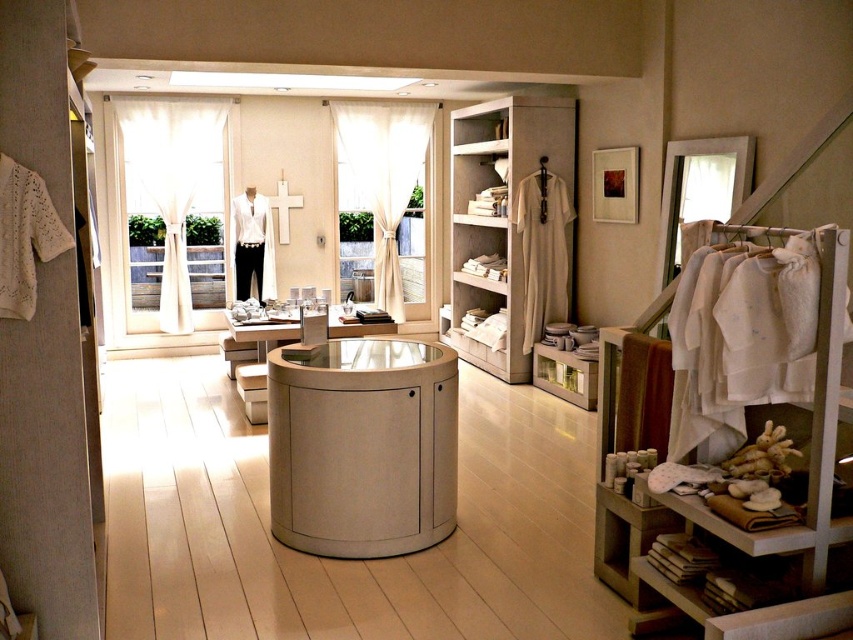
Question: Is white matte vanity at center in front of white matte shirt at center?

Choices:
 (A) no
 (B) yes

Answer: (B)

Question: Can you confirm if white matte vanity at center is positioned above white matte shirt at center?

Choices:
 (A) yes
 (B) no

Answer: (B)

Question: Which object appears farthest from the camera in this image?

Choices:
 (A) white matte shirt at center
 (B) white fabric clothes at right
 (C) matte white vanity at center

Answer: (A)

Question: Which object appears closest to the camera in this image?

Choices:
 (A) white matte vanity at center
 (B) white fabric clothes at right
 (C) matte white vanity at center
 (D) light beige fabric robe at center

Answer: (B)

Question: Is matte white vanity at center to the right of white matte shirt at center from the viewer's perspective?

Choices:
 (A) no
 (B) yes

Answer: (B)

Question: Which object is the farthest from the white matte shirt at center?

Choices:
 (A) white fabric clothes at right
 (B) matte white vanity at center
 (C) white matte vanity at center
 (D) beige fabric shelf at center right

Answer: (A)